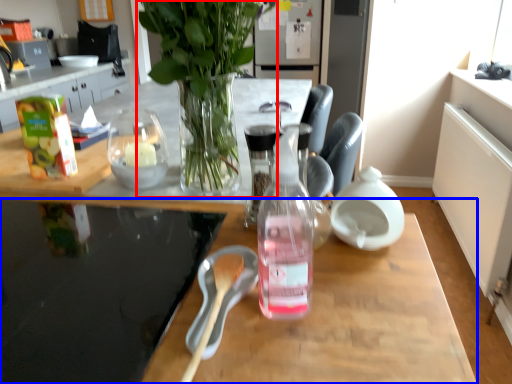
Question: Which object is further to the camera taking this photo, houseplant (highlighted by a red box) or desk (highlighted by a blue box)?

Choices:
 (A) houseplant
 (B) desk

Answer: (A)